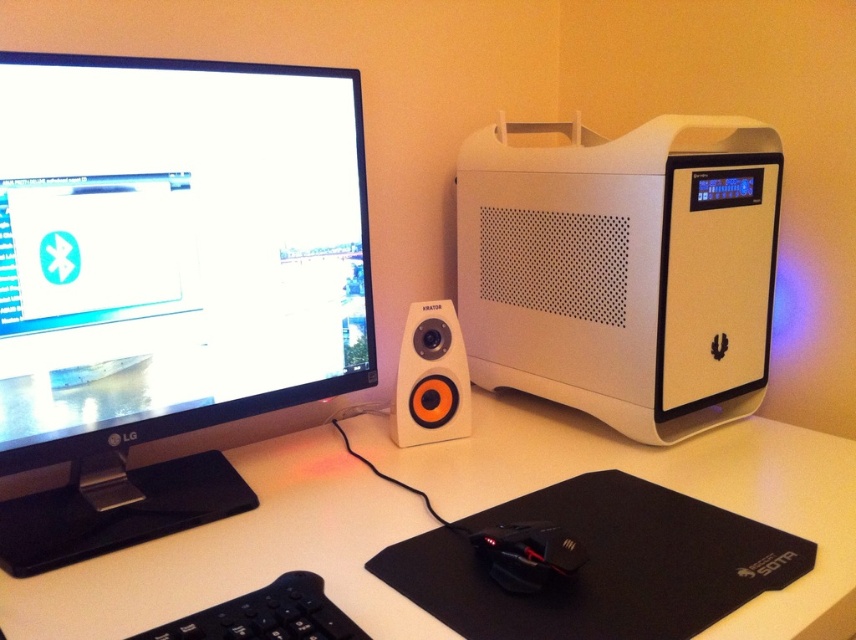
You are sitting at a desk and want to adjust your seating position so that your eyes are exactly 24 inches away from the black glossy monitor at left. Currently, you are 26.83 inches away. Should you move closer or farther away from the monitor?

Since the black glossy monitor at left is currently 26.83 inches away and you want to be 24 inches away, you should move closer to the monitor by approximately 2.83 inches.

You are sitting at the desk and want to reach both points on the desk. Which point is closer to you, point (676, 422) or point (223, 605)?

Point (676, 422) is closer to you because it is further to the viewer than point (223, 605).

You are a delivery person who needs to place a new keyboard on the desk without moving any existing items. The new keyboard is 0.5 meters long. Can you fit it in front of the white matte speaker at center while maintaining at least 0.2 meters of space between the speaker and the keyboard?

The distance of white matte speaker at center from camera is 1.00 meters. Since the new keyboard requires 0.5 meters plus 0.2 meters of space, totaling 0.7 meters, and the speaker is only 1.00 meters away from the camera, there is insufficient space to place the keyboard in front of the speaker while maintaining the required distance.